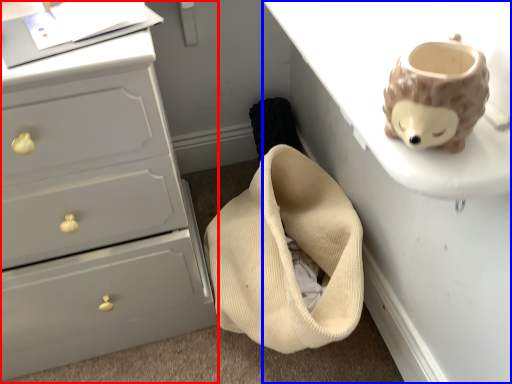
Question: Which point is closer to the camera, chest of drawers (highlighted by a red box) or table (highlighted by a blue box)?

Choices:
 (A) chest of drawers
 (B) table

Answer: (B)